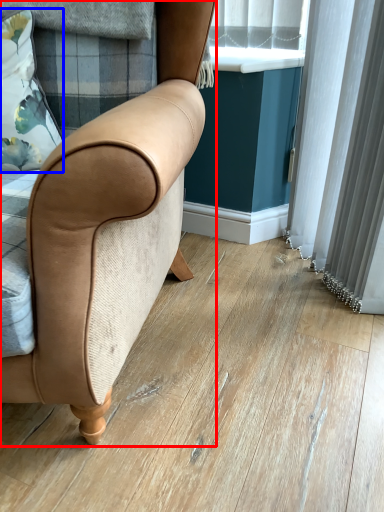
Question: Which point is further to the camera, chair (highlighted by a red box) or pillow (highlighted by a blue box)?

Choices:
 (A) chair
 (B) pillow

Answer: (B)